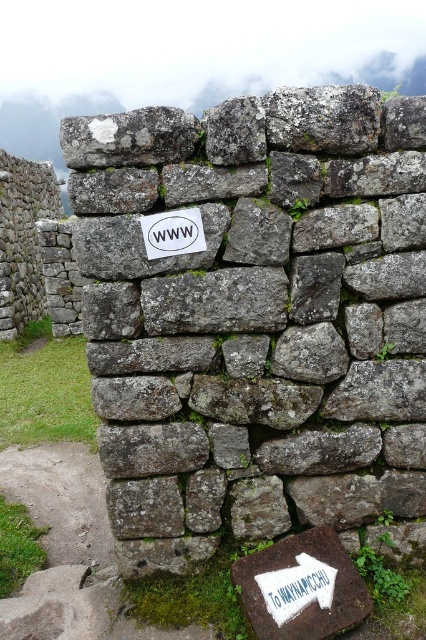
Who is higher up, gray rough stone at center or white chalk arrow at lower center?

gray rough stone at center is higher up.

Which is in front, point (333, 380) or point (290, 596)?

Positioned in front is point (290, 596).

Where is `gray rough stone at center`? The height and width of the screenshot is (640, 426). gray rough stone at center is located at coordinates (264, 328).

You are a GUI agent. You are given a task and a screenshot of the screen. Output one action in this format:
    pyautogui.click(x=<x>, y=<y>)
    Task: Click on the white chalk arrow at lower center
    
    Given the screenshot: What is the action you would take?
    pyautogui.click(x=296, y=588)

Is white chalk arrow at lower center shorter than white paper sign at center?

Correct, white chalk arrow at lower center is not as tall as white paper sign at center.

Who is more distant from viewer, (x=270, y=609) or (x=166, y=252)?

The point (x=166, y=252) is behind.

The width and height of the screenshot is (426, 640). I want to click on white chalk arrow at lower center, so click(296, 588).

Is point (94, 161) behind point (147, 234)?

No, (94, 161) is in front of (147, 234).

Does white rough stone at upper center have a larger size compared to white paper sign at center?

Indeed, white rough stone at upper center has a larger size compared to white paper sign at center.

The height and width of the screenshot is (640, 426). Describe the element at coordinates (129, 138) in the screenshot. I see `white rough stone at upper center` at that location.

Image resolution: width=426 pixels, height=640 pixels. Identify the location of white rough stone at upper center. (129, 138).